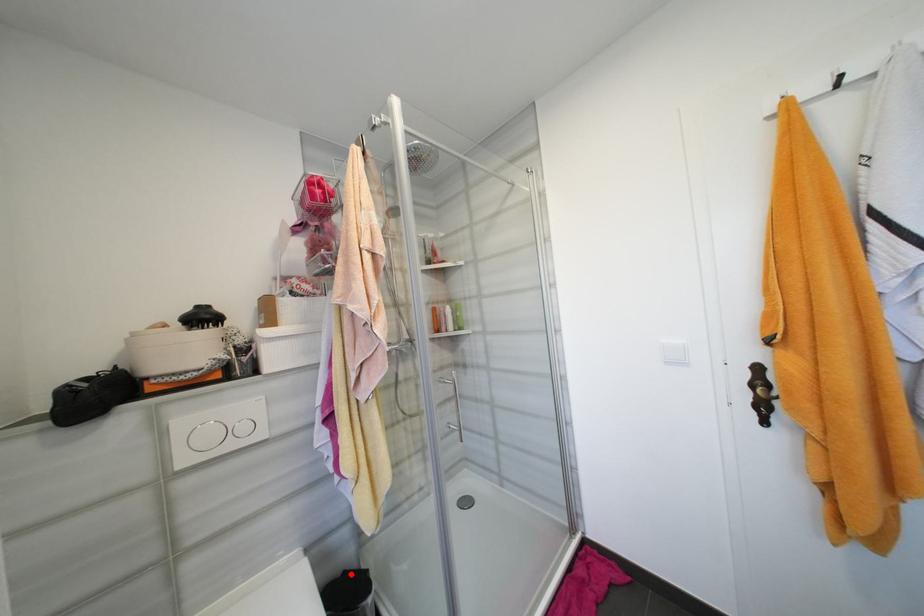
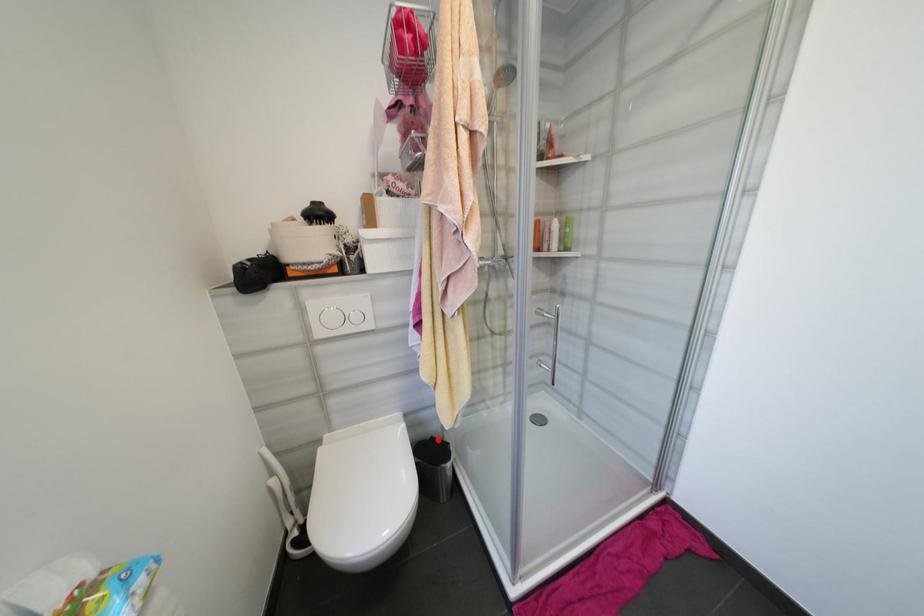
I am providing you with two images of the same scene from different viewpoints. A red point is marked on the first image and another point is marked on the second image. Are the points marked in image1 and image2 representing the same 3D position?

Yes